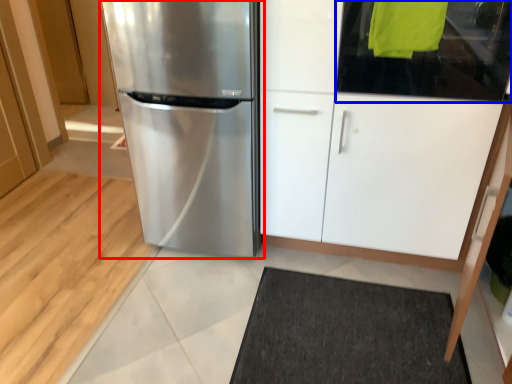
Question: Which point is further to the camera, refrigerator (highlighted by a red box) or glass door (highlighted by a blue box)?

Choices:
 (A) refrigerator
 (B) glass door

Answer: (A)